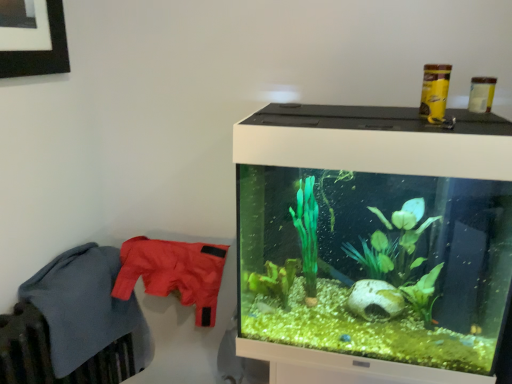
Question: Based on their positions, is soft fleece blanket at left, the 1th clothing in the left-to-right sequence, located to the left or right of matte nylon jacket at left, marked as the first clothing in a right-to-left arrangement?

Choices:
 (A) left
 (B) right

Answer: (A)

Question: Would you say soft fleece blanket at left, the 1th clothing in the left-to-right sequence, is inside or outside matte nylon jacket at left, marked as the first clothing in a right-to-left arrangement?

Choices:
 (A) outside
 (B) inside

Answer: (A)

Question: Which object is the closest to the soft fleece blanket at left, positioned as the 2th clothing in right-to-left order?

Choices:
 (A) matte nylon jacket at left, arranged as the second clothing when viewed from the left
 (B) transparent glass aquarium at right

Answer: (A)

Question: Estimate the real-world distances between objects in this image. Which object is closer to the soft fleece blanket at left, positioned as the 2th clothing in right-to-left order?

Choices:
 (A) matte nylon jacket at left, marked as the first clothing in a right-to-left arrangement
 (B) transparent glass aquarium at right

Answer: (A)